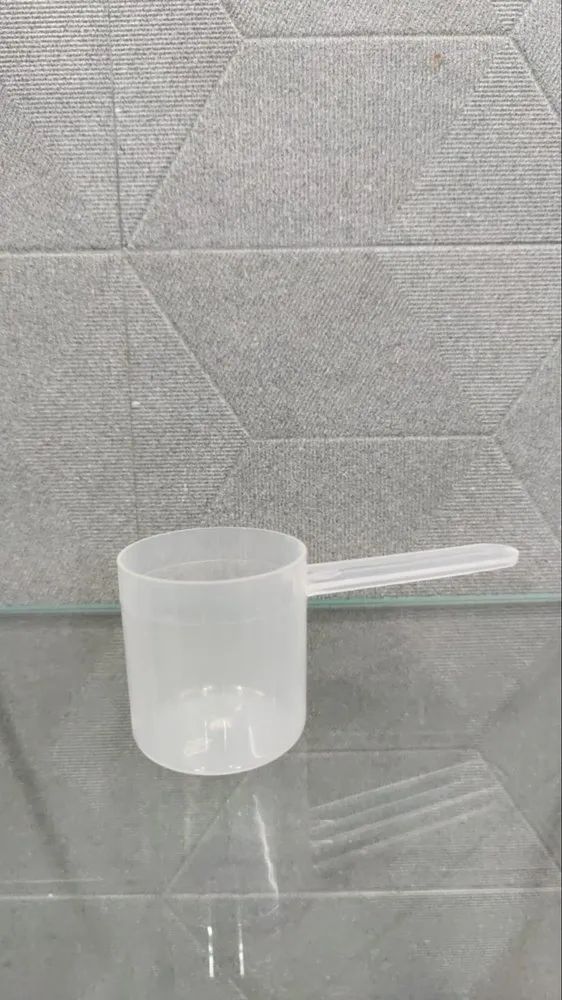
Locate an element on the screen. handle of measuring cup is located at coordinates (403, 568).